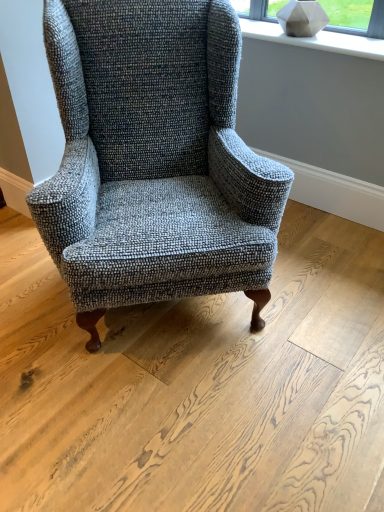
Locate an element on the screen. This screenshot has height=512, width=384. free location to the right of textured gray wingback chair at center is located at coordinates (324, 284).